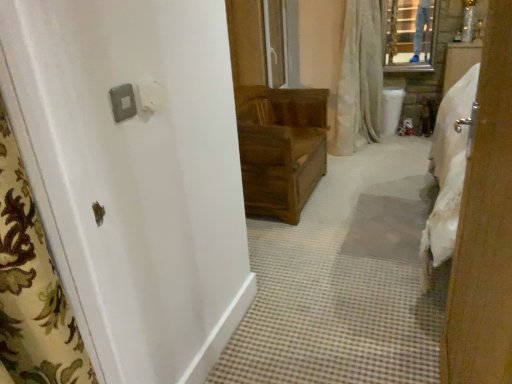
Describe the element at coordinates (134, 176) in the screenshot. I see `wooden door at center` at that location.

I want to click on wooden door at center, so click(x=134, y=176).

This screenshot has height=384, width=512. In order to click on wooden door at center in this screenshot , I will do `click(134, 176)`.

Locate an element on the screen. The image size is (512, 384). door that appears above the white textured shower curtain at upper center (from a real-world perspective) is located at coordinates (134, 176).

Can you tell me how much wooden door at center and white textured shower curtain at upper center differ in facing direction?

The facing directions of wooden door at center and white textured shower curtain at upper center are 89.6 degrees apart.

Is point (69, 220) positioned behind point (362, 31)?

No, it is in front of (362, 31).

From a real-world perspective, which is physically below, wooden door at center or white textured shower curtain at upper center?

white textured shower curtain at upper center is physically lower.

Looking at this image, is wooden door at center at the right side of wooden chest at center?

No, wooden door at center is not to the right of wooden chest at center.

Does wooden door at center have a lesser width compared to wooden chest at center?

Yes.

Looking at this image, can you confirm if wooden door at center is bigger than wooden chest at center?

No.

Considering the sizes of objects white plastic light switch at upper left, which is counted as the second light switch, starting from the left, and white textured shower curtain at upper center in the image provided, who is wider, white plastic light switch at upper left, which is counted as the second light switch, starting from the left, or white textured shower curtain at upper center?

white textured shower curtain at upper center is wider.

From the image's perspective, relative to white textured shower curtain at upper center, is white plastic light switch at upper left, which is counted as the second light switch, starting from the left, above or below?

white plastic light switch at upper left, which is counted as the second light switch, starting from the left, is situated lower than white textured shower curtain at upper center in the image.

How much distance is there between satin silver switch at upper left, which ranks as the first light switch in left-to-right order, and wooden chest at center?

satin silver switch at upper left, which ranks as the first light switch in left-to-right order, and wooden chest at center are 1.87 meters apart from each other.

What's the angular difference between satin silver switch at upper left, acting as the 2th light switch starting from the right, and wooden chest at center's facing directions?

They differ by 0.474 degrees in their facing directions.

Is the position of satin silver switch at upper left, acting as the 2th light switch starting from the right, more distant than that of wooden chest at center?

No, it is in front of wooden chest at center.

In the image, there is a satin silver switch at upper left, acting as the 2th light switch starting from the right. Identify the location of furniture below it (from a real-world perspective). (281, 148).

From a real-world perspective, between white plastic light switch at upper left, which is counted as the second light switch, starting from the left, and wooden chest at center, who is vertically lower?

wooden chest at center.

Is white plastic light switch at upper left, which is counted as the second light switch, starting from the left, situated inside wooden chest at center or outside?

white plastic light switch at upper left, which is counted as the second light switch, starting from the left, cannot be found inside wooden chest at center.

Does white plastic light switch at upper left, which is counted as the second light switch, starting from the left, lie behind wooden chest at center?

No, white plastic light switch at upper left, which is counted as the second light switch, starting from the left, is closer to the viewer.

Which of these two, white plastic light switch at upper left, which is counted as the second light switch, starting from the left, or wooden chest at center, stands shorter?

With less height is white plastic light switch at upper left, which is counted as the second light switch, starting from the left.

Is wooden door at center closer to the viewer compared to satin silver switch at upper left, acting as the 2th light switch starting from the right?

Yes, the depth of wooden door at center is less than that of satin silver switch at upper left, acting as the 2th light switch starting from the right.

Locate an element on the screen. This screenshot has height=384, width=512. light switch that is the 1st object above the wooden door at center (from a real-world perspective) is located at coordinates (123, 102).

Considering the sizes of wooden door at center and satin silver switch at upper left, acting as the 2th light switch starting from the right, in the image, is wooden door at center wider or thinner than satin silver switch at upper left, acting as the 2th light switch starting from the right,?

wooden door at center is wider than satin silver switch at upper left, acting as the 2th light switch starting from the right.

From the image's perspective, is white textured shower curtain at upper center under wooden chest at center?

No.

You are a GUI agent. You are given a task and a screenshot of the screen. Output one action in this format:
    pyautogui.click(x=<x>, y=<y>)
    Task: Click on the furniture that appears below the white textured shower curtain at upper center (from a real-world perspective)
    Image resolution: width=512 pixels, height=384 pixels.
    Given the screenshot: What is the action you would take?
    pyautogui.click(x=281, y=148)

From a real-world perspective, which object stands above the other?

white textured shower curtain at upper center.

What are the coordinates of `shower curtain below the wooden door at center (from a real-world perspective)` in the screenshot? It's located at (359, 78).

At what (x,y) coordinates should I click in order to perform the action: click on furniture above the wooden door at center (from the image's perspective). Please return your answer as a coordinate pair (x, y). The height and width of the screenshot is (384, 512). Looking at the image, I should click on coord(281,148).

Considering their positions, is wooden chest at center positioned further to wooden door at center than satin silver switch at upper left, which ranks as the first light switch in left-to-right order?

Among the two, wooden chest at center is located further to wooden door at center.

Considering their positions, is satin silver switch at upper left, which ranks as the first light switch in left-to-right order, positioned further to wooden door at center than wooden chest at center?

wooden chest at center lies further to wooden door at center than the other object.

Estimate the real-world distances between objects in this image. Which object is closer to white plastic light switch at upper left, which is counted as the second light switch, starting from the left, wooden chest at center or satin silver switch at upper left, acting as the 2th light switch starting from the right?

satin silver switch at upper left, acting as the 2th light switch starting from the right, is positioned closer to the anchor white plastic light switch at upper left, which is counted as the second light switch, starting from the left.

Looking at the image, which one is located closer to wooden door at center, wooden chest at center or white textured shower curtain at upper center?

wooden chest at center is closer to wooden door at center.

Based on their spatial positions, is white textured shower curtain at upper center or satin silver switch at upper left, acting as the 2th light switch starting from the right, further from wooden door at center?

Based on the image, white textured shower curtain at upper center appears to be further to wooden door at center.

Based on their spatial positions, is white textured shower curtain at upper center or wooden door at center closer to wooden chest at center?

white textured shower curtain at upper center is closer to wooden chest at center.

When comparing their distances from wooden chest at center, does white plastic light switch at upper left, the first light switch viewed from the right, or satin silver switch at upper left, which ranks as the first light switch in left-to-right order, seem further?

satin silver switch at upper left, which ranks as the first light switch in left-to-right order, lies further to wooden chest at center than the other object.

Looking at the image, which one is located further to wooden chest at center, satin silver switch at upper left, which ranks as the first light switch in left-to-right order, or white plastic light switch at upper left, which is counted as the second light switch, starting from the left?

Among the two, satin silver switch at upper left, which ranks as the first light switch in left-to-right order, is located further to wooden chest at center.

At what (x,y) coordinates should I click in order to perform the action: click on furniture between wooden door at center and white textured shower curtain at upper center in the front-back direction. Please return your answer as a coordinate pair (x, y). This screenshot has width=512, height=384. Looking at the image, I should click on (281, 148).

Identify the location of furniture positioned between white plastic light switch at upper left, which is counted as the second light switch, starting from the left, and white textured shower curtain at upper center from near to far. The image size is (512, 384). (281, 148).

This screenshot has width=512, height=384. Find the location of `light switch positioned between satin silver switch at upper left, which ranks as the first light switch in left-to-right order, and white textured shower curtain at upper center from near to far`. light switch positioned between satin silver switch at upper left, which ranks as the first light switch in left-to-right order, and white textured shower curtain at upper center from near to far is located at coordinates (151, 96).

Find the location of `furniture between satin silver switch at upper left, acting as the 2th light switch starting from the right, and white textured shower curtain at upper center from front to back`. furniture between satin silver switch at upper left, acting as the 2th light switch starting from the right, and white textured shower curtain at upper center from front to back is located at coordinates (281, 148).